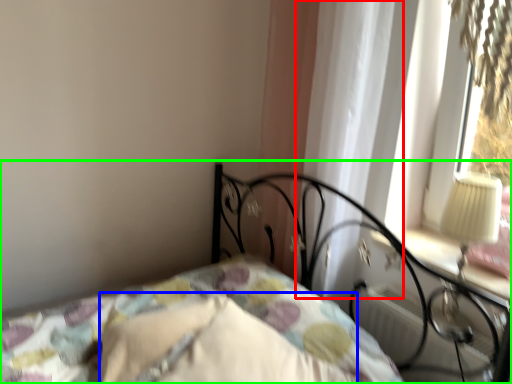
Question: Considering the real-world distances, which object is closest to curtain (highlighted by a red box)? pillow (highlighted by a blue box) or bed (highlighted by a green box).

Choices:
 (A) pillow
 (B) bed

Answer: (B)